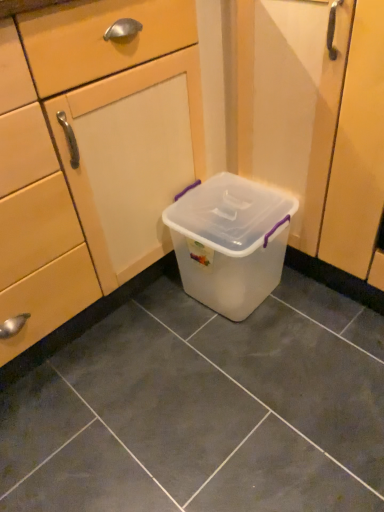
Describe the element at coordinates (230, 242) in the screenshot. I see `transparent plastic storage box at center` at that location.

What do you see at coordinates (107, 148) in the screenshot? The image size is (384, 512). I see `transparent plastic container at center` at bounding box center [107, 148].

Find the location of a particular element. The height and width of the screenshot is (512, 384). transparent plastic container at center is located at coordinates coord(107,148).

Where is `transparent plastic storage box at center`? The image size is (384, 512). transparent plastic storage box at center is located at coordinates (230, 242).

Does point (168, 479) appear closer or farther from the camera than point (272, 197)?

Point (168, 479) is positioned closer to the camera compared to point (272, 197).

Would you say translucent plastic container at center is a long distance from transparent plastic storage box at center?

No, there isn't a large distance between translucent plastic container at center and transparent plastic storage box at center.

Is translucent plastic container at center aimed at transparent plastic storage box at center?

No, translucent plastic container at center is not aimed at transparent plastic storage box at center.

Can you confirm if translucent plastic container at center is thinner than transparent plastic storage box at center?

No.

Is transparent plastic container at center looking in the opposite direction of transparent plastic storage box at center?

transparent plastic container at center does not have its back to transparent plastic storage box at center.

Is transparent plastic container at center far away from transparent plastic storage box at center?

No.

From the image's perspective, between transparent plastic container at center and transparent plastic storage box at center, which one is located above?

transparent plastic container at center appears higher in the image.

Which of these two, transparent plastic container at center or transparent plastic storage box at center, stands taller?

With more height is transparent plastic container at center.

Are transparent plastic storage box at center and translucent plastic container at center beside each other?

No, transparent plastic storage box at center is not making contact with translucent plastic container at center.

Considering the sizes of objects transparent plastic storage box at center and translucent plastic container at center in the image provided, who is thinner, transparent plastic storage box at center or translucent plastic container at center?

transparent plastic storage box at center is thinner.

Considering the positions of point (248, 213) and point (95, 368), is point (248, 213) closer or farther from the camera than point (95, 368)?

Point (248, 213) is closer to the camera than point (95, 368).

How many degrees apart are the facing directions of transparent plastic storage box at center and translucent plastic container at center?

179 degrees.

Is transparent plastic storage box at center far away from transparent plastic container at center?

No.

From the picture: Between transparent plastic storage box at center and transparent plastic container at center, which one has more height?

Standing taller between the two is transparent plastic container at center.

Is transparent plastic storage box at center oriented away from transparent plastic container at center?

That's not correct — transparent plastic storage box at center is not looking away from transparent plastic container at center.

In the scene shown: How many degrees apart are the facing directions of transparent plastic storage box at center and transparent plastic container at center?

They differ by 90 degrees in their facing directions.

Based on their positions, is translucent plastic container at center located to the left or right of transparent plastic container at center?

translucent plastic container at center is to the right of transparent plastic container at center.

Is translucent plastic container at center oriented away from transparent plastic container at center?

No, transparent plastic container at center is not at the back of translucent plastic container at center.

Considering the sizes of translucent plastic container at center and transparent plastic container at center in the image, is translucent plastic container at center wider or thinner than transparent plastic container at center?

translucent plastic container at center is wider than transparent plastic container at center.

What's the angular difference between translucent plastic container at center and transparent plastic container at center's facing directions?

The angle between the facing direction of translucent plastic container at center and the facing direction of transparent plastic container at center is 90.8 degrees.

Considering the positions of point (93, 255) and point (124, 361), is point (93, 255) closer or farther from the camera than point (124, 361)?

Point (93, 255) appears to be closer to the viewer than point (124, 361).

Is transparent plastic container at center oriented away from translucent plastic container at center?

No.

From the image's perspective, is transparent plastic container at center above or below translucent plastic container at center?

Clearly, from the image's perspective, transparent plastic container at center is above translucent plastic container at center.

Can we say transparent plastic container at center lies outside translucent plastic container at center?

Yes, transparent plastic container at center is not within translucent plastic container at center.

Where is `storage box behind the translucent plastic container at center`? Image resolution: width=384 pixels, height=512 pixels. storage box behind the translucent plastic container at center is located at coordinates (230, 242).

The height and width of the screenshot is (512, 384). Find the location of `cabinetry that appears above the transparent plastic storage box at center (from the image's perspective)`. cabinetry that appears above the transparent plastic storage box at center (from the image's perspective) is located at coordinates (107, 148).

Based on their spatial positions, is transparent plastic storage box at center or transparent plastic container at center further from translucent plastic container at center?

Among the two, transparent plastic container at center is located further to translucent plastic container at center.

Estimate the real-world distances between objects in this image. Which object is further from transparent plastic storage box at center, translucent plastic container at center or transparent plastic container at center?

translucent plastic container at center lies further to transparent plastic storage box at center than the other object.

Based on the photo, considering their positions, is transparent plastic container at center positioned further to transparent plastic storage box at center than translucent plastic container at center?

translucent plastic container at center is positioned further to the anchor transparent plastic storage box at center.

Consider the image. From the image, which object appears to be nearer to translucent plastic container at center, transparent plastic container at center or transparent plastic storage box at center?

The object closer to translucent plastic container at center is transparent plastic storage box at center.

Considering their positions, is translucent plastic container at center positioned further to transparent plastic container at center than transparent plastic storage box at center?

translucent plastic container at center lies further to transparent plastic container at center than the other object.

When comparing their distances from transparent plastic container at center, does transparent plastic storage box at center or translucent plastic container at center seem closer?

Based on the image, transparent plastic storage box at center appears to be nearer to transparent plastic container at center.

I want to click on storage box between transparent plastic container at center and translucent plastic container at center vertically, so click(x=230, y=242).